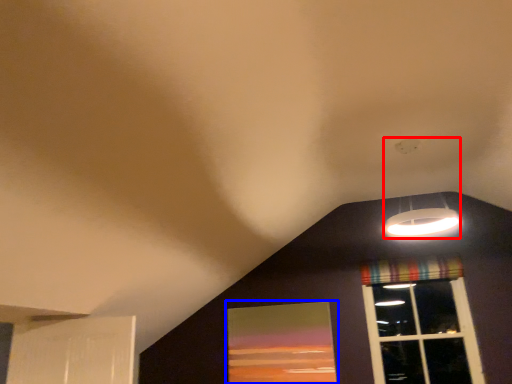
Question: Among these objects, which one is nearest to the camera, lamp (highlighted by a red box) or window screen (highlighted by a blue box)?

Choices:
 (A) lamp
 (B) window screen

Answer: (A)